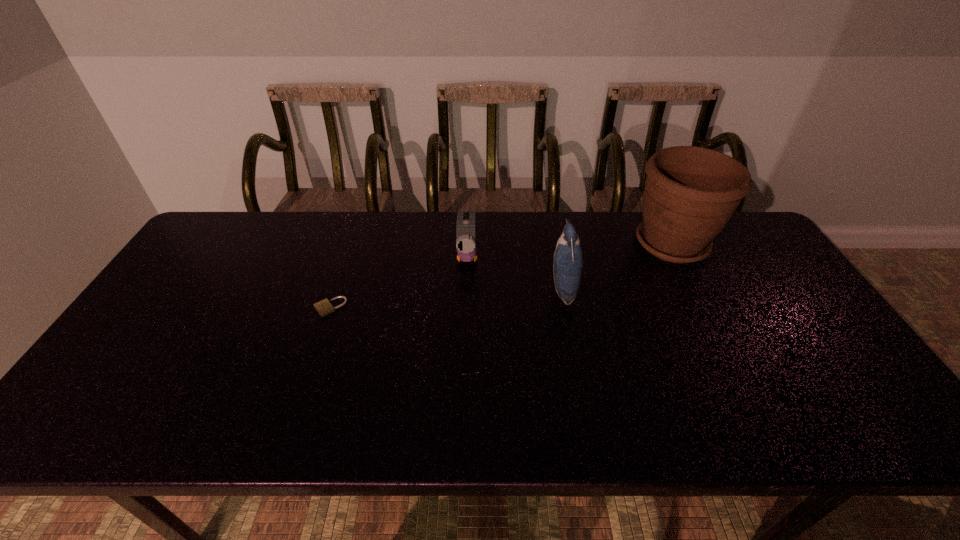
The width and height of the screenshot is (960, 540). Identify the location of the tallest object. (690, 194).

Find the location of `the rightmost object`. the rightmost object is located at coordinates (690, 194).

The height and width of the screenshot is (540, 960). I want to click on the right bird, so click(568, 259).

You are a GUI agent. You are given a task and a screenshot of the screen. Output one action in this format:
    pyautogui.click(x=<x>, y=<y>)
    Task: Click on the second object from right to left
    This screenshot has height=540, width=960.
    Given the screenshot: What is the action you would take?
    pyautogui.click(x=568, y=259)

Find the location of a particular element. the left bird is located at coordinates (466, 247).

Locate an element on the screen. the third object from right to left is located at coordinates (466, 247).

At what (x,y) coordinates should I click in order to perform the action: click on the leftmost object. Please return your answer as a coordinate pair (x, y). This screenshot has width=960, height=540. Looking at the image, I should click on (324, 307).

The width and height of the screenshot is (960, 540). What are the coordinates of `the shortest object` in the screenshot? It's located at (324, 307).

This screenshot has height=540, width=960. Find the location of `vacant space located on the front of the tallest object`. vacant space located on the front of the tallest object is located at coordinates (703, 306).

Image resolution: width=960 pixels, height=540 pixels. Find the location of `vacant region located at the tip of the taller bird's beak`. vacant region located at the tip of the taller bird's beak is located at coordinates (463, 288).